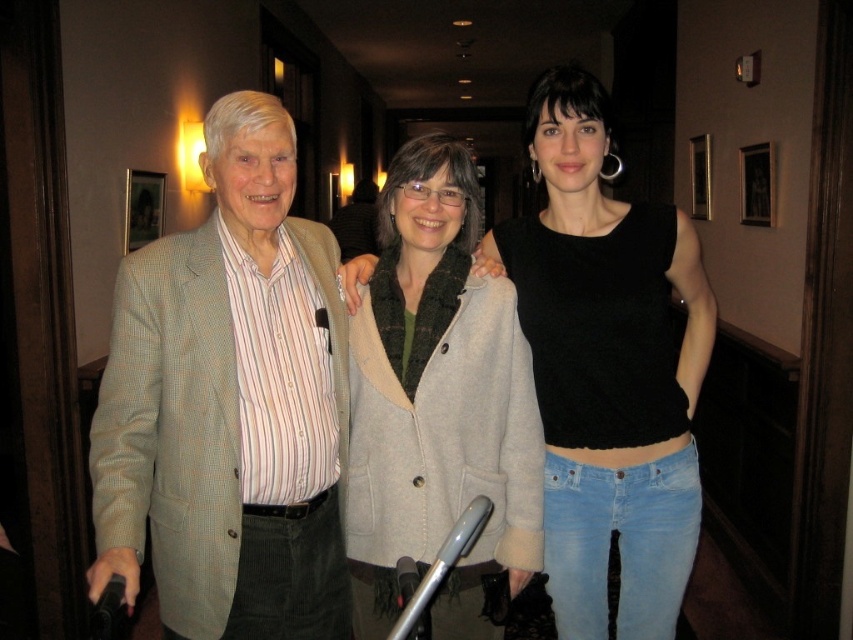
Question: Which point is farther from the camera taking this photo?

Choices:
 (A) (126, 490)
 (B) (370, 292)

Answer: (B)

Question: Estimate the real-world distances between objects in this image. Which object is farther from the light brown wool jacket at left?

Choices:
 (A) light gray wool coat at center
 (B) black matte tank top at center

Answer: (B)

Question: Is light brown wool jacket at left below black matte tank top at center?

Choices:
 (A) no
 (B) yes

Answer: (B)

Question: Which of the following is the farthest from the observer?

Choices:
 (A) (579, 488)
 (B) (386, 241)
 (C) (163, 604)

Answer: (B)

Question: Can you confirm if black matte tank top at center is smaller than light gray wool coat at center?

Choices:
 (A) yes
 (B) no

Answer: (B)

Question: Does light brown wool jacket at left appear on the right side of black matte tank top at center?

Choices:
 (A) yes
 (B) no

Answer: (B)